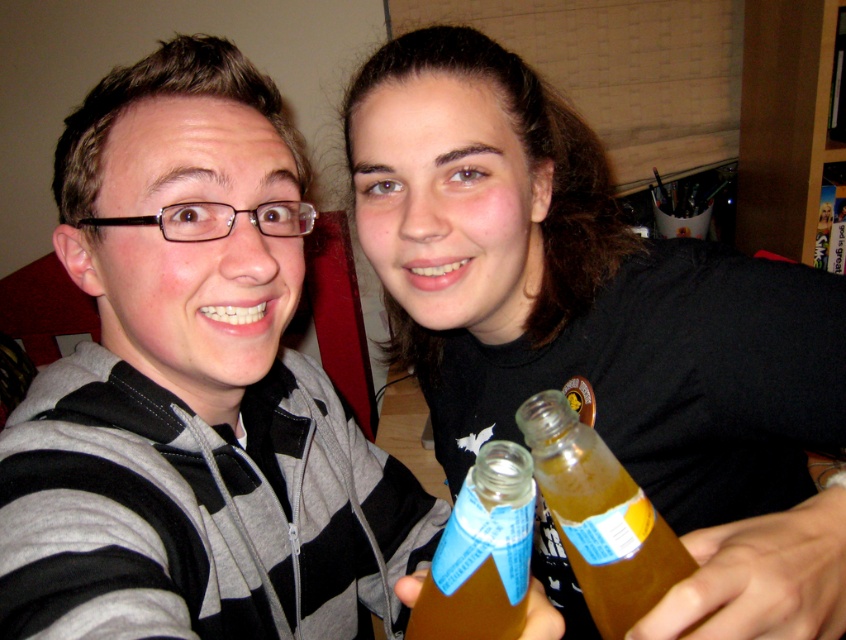
You are a photographer trying to capture a clear shot of the gray striped hoodie at center and the translucent glass bottle at center. Since you want to focus on the hoodie, which object should you adjust your camera to prioritize in terms of depth of field?

The gray striped hoodie at center is closer to the viewer than the translucent glass bottle at center, so you should adjust your camera to prioritize focusing on the gray striped hoodie at center to ensure it is in sharp focus while the bottle may appear slightly blurred.

In the scene shown: You are a photographer trying to capture a clear shot of both the gray striped hoodie at center and the translucent glass bottle at center. Which object should you focus on first if you want to ensure the taller one is in focus?

The gray striped hoodie at center is taller than the translucent glass bottle at center, so you should focus on the gray striped hoodie at center first to ensure it is in focus.

You are a photographer trying to capture a clear photo of the gray striped hoodie at center and the translucent glass bottle at center. Since you want to focus on the hoodie, which object should you place closer to the camera?

The gray striped hoodie at center has a larger size compared to the translucent glass bottle at center, so to focus on the hoodie, you should place the gray striped hoodie at center closer to the camera to ensure it fills the frame properly.